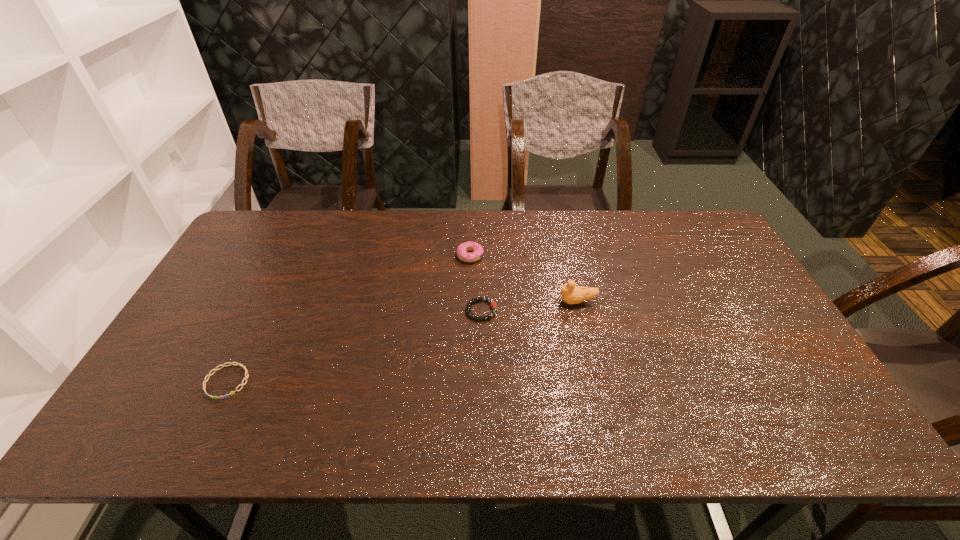
The height and width of the screenshot is (540, 960). I want to click on free space between the rightmost object and the farther bracelet, so click(530, 306).

The width and height of the screenshot is (960, 540). I want to click on free space between the third shortest object and the farther bracelet, so click(x=476, y=283).

Image resolution: width=960 pixels, height=540 pixels. Identify the location of object that is the second nearest to the farther bracelet. (571, 294).

You are a GUI agent. You are given a task and a screenshot of the screen. Output one action in this format:
    pyautogui.click(x=<x>, y=<y>)
    Task: Click on the object that is the third closest to the right bracelet
    The height and width of the screenshot is (540, 960).
    Given the screenshot: What is the action you would take?
    (237, 364)

Where is `free space that satisfies the following two spatial constraints: 1. on the face of the rightmost object; 2. on the front side of the farther bracelet`? free space that satisfies the following two spatial constraints: 1. on the face of the rightmost object; 2. on the front side of the farther bracelet is located at coordinates (580, 310).

Locate an element on the screen. This screenshot has height=540, width=960. vacant position in the image that satisfies the following two spatial constraints: 1. on the face of the duckling; 2. on the surface of the leftmost object showing star-shaped elements is located at coordinates (595, 382).

In order to click on vacant space that satisfies the following two spatial constraints: 1. on the face of the tallest object; 2. on the surface of the nearest object showing star-shaped elements in this screenshot , I will do `click(595, 382)`.

Locate an element on the screen. The width and height of the screenshot is (960, 540). free location that satisfies the following two spatial constraints: 1. on the face of the tallest object; 2. on the surface of the left bracelet showing star-shaped elements is located at coordinates (595, 382).